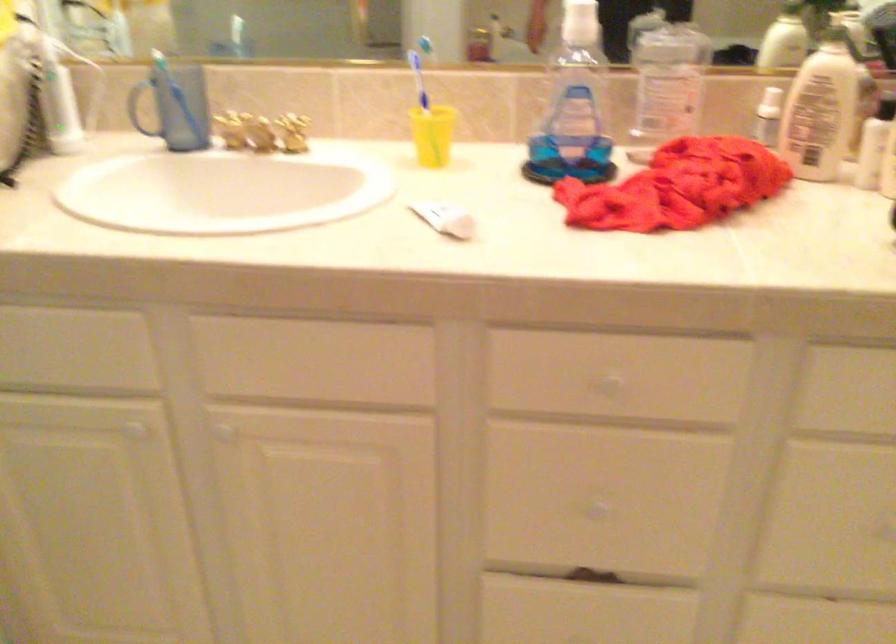
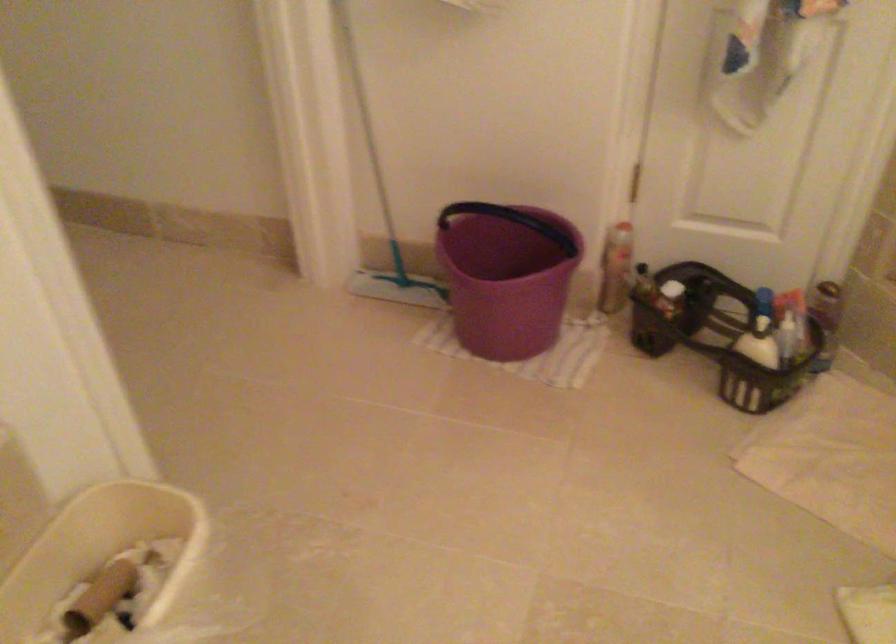
Based on the continuous images, in which direction is the camera rotating?

The camera's rotation is toward left-down.